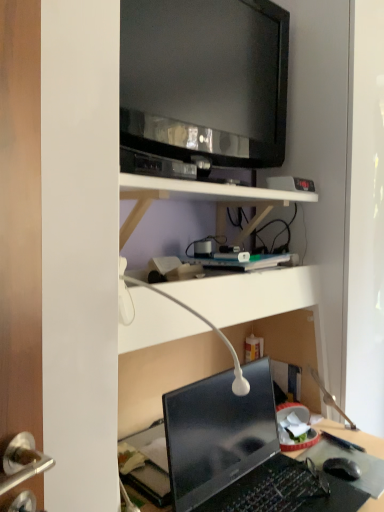
Find the location of a particular element. black glossy television at upper center is located at coordinates (205, 80).

Can you confirm if white matte shelf at upper center is positioned to the right of black glossy television at upper center?

No.

From a real-world perspective, which is physically below, white matte shelf at upper center or black glossy television at upper center?

From a 3D spatial view, white matte shelf at upper center is below.

Looking at this image, from their relative heights in the image, would you say white matte shelf at upper center is taller or shorter than black glossy television at upper center?

white matte shelf at upper center is shorter than black glossy television at upper center.

Considering the sizes of white matte shelf at upper center and black glossy television at upper center in the image, is white matte shelf at upper center wider or thinner than black glossy television at upper center?

Considering their sizes, white matte shelf at upper center looks broader than black glossy television at upper center.

Considering the relative sizes of black glossy television at upper center and white glossy table lamp at center in the image provided, is black glossy television at upper center shorter than white glossy table lamp at center?

In fact, black glossy television at upper center may be taller than white glossy table lamp at center.

Can you tell me how much black glossy television at upper center and white glossy table lamp at center differ in facing direction?

They differ by 0.701 degrees in their facing directions.

From a real-world perspective, which object rests below the other?

In real-world perspective, white glossy table lamp at center is lower.

Is black glossy television at upper center wider than white glossy table lamp at center?

In fact, black glossy television at upper center might be narrower than white glossy table lamp at center.

Based on the photo, is black matte computer mouse at lower right aimed at black glossy television at upper center?

No, black matte computer mouse at lower right is not aimed at black glossy television at upper center.

Is black matte computer mouse at lower right further to the viewer compared to black glossy television at upper center?

Yes, it is behind black glossy television at upper center.

Would you say black matte computer mouse at lower right is a long distance from black glossy television at upper center?

Yes, black matte computer mouse at lower right is far from black glossy television at upper center.

Which of these two, white glossy table lamp at center or black glossy television at upper center, is bigger?

black glossy television at upper center.

Does white glossy table lamp at center come behind black glossy television at upper center?

No, it is not.

Would you say white glossy table lamp at center is outside black glossy television at upper center?

Yes, white glossy table lamp at center is outside of black glossy television at upper center.

From a real-world perspective, is white glossy table lamp at center located higher than black glossy television at upper center?

Actually, white glossy table lamp at center is physically below black glossy television at upper center in the real world.

Is point (255, 501) farther from camera compared to point (331, 471)?

No.

I want to click on computer mouse on the right side of glossy black laptop at lower center, so click(342, 468).

Which is farther, (177, 86) or (181, 423)?

The point (177, 86) is behind.

This screenshot has width=384, height=512. Identify the location of laptop below the black glossy television at upper center (from the image's perspective). [x=231, y=448].

Is black glossy television at upper center completely or partially outside of glossy black laptop at lower center?

Absolutely, black glossy television at upper center is external to glossy black laptop at lower center.

Could you tell me if black glossy television at upper center is turned towards glossy black laptop at lower center?

No.

In the scene shown: Which object is wider, glossy black laptop at lower center or white glossy table lamp at center?

white glossy table lamp at center is wider.

Who is smaller, glossy black laptop at lower center or white glossy table lamp at center?

With smaller size is white glossy table lamp at center.

From the picture: Would you consider glossy black laptop at lower center to be distant from white glossy table lamp at center?

No, there isn't a large distance between glossy black laptop at lower center and white glossy table lamp at center.

How different are the orientations of glossy black laptop at lower center and white glossy table lamp at center in degrees?

The angle between the facing direction of glossy black laptop at lower center and the facing direction of white glossy table lamp at center is 0.000788 degrees.

The width and height of the screenshot is (384, 512). Identify the location of shelf below the black glossy television at upper center (from a real-world perspective). (202, 199).

Image resolution: width=384 pixels, height=512 pixels. I want to click on television located above the white glossy table lamp at center (from the image's perspective), so click(x=205, y=80).

From the image, which object appears to be nearer to white glossy table lamp at center, black matte computer mouse at lower right or glossy black laptop at lower center?

glossy black laptop at lower center is closer to white glossy table lamp at center.

Looking at this image, considering their positions, is glossy black laptop at lower center positioned further to white matte shelf at upper center than black matte computer mouse at lower right?

Based on the image, black matte computer mouse at lower right appears to be further to white matte shelf at upper center.

Based on their spatial positions, is black matte computer mouse at lower right or white glossy table lamp at center further from black glossy television at upper center?

black matte computer mouse at lower right lies further to black glossy television at upper center than the other object.

Based on their spatial positions, is black matte computer mouse at lower right or black glossy television at upper center further from white matte shelf at upper center?

black matte computer mouse at lower right.

Based on their spatial positions, is black glossy television at upper center or glossy black laptop at lower center further from white matte shelf at upper center?

Based on the image, glossy black laptop at lower center appears to be further to white matte shelf at upper center.

Estimate the real-world distances between objects in this image. Which object is further from black glossy television at upper center, white glossy table lamp at center or glossy black laptop at lower center?

glossy black laptop at lower center is positioned further to the anchor black glossy television at upper center.

Looking at the image, which one is located further to white glossy table lamp at center, glossy black laptop at lower center or black matte computer mouse at lower right?

black matte computer mouse at lower right.

Consider the image. Estimate the real-world distances between objects in this image. Which object is closer to black glossy television at upper center, black matte computer mouse at lower right or glossy black laptop at lower center?

glossy black laptop at lower center.

The image size is (384, 512). Find the location of `table lamp that lies between white matte shelf at upper center and glossy black laptop at lower center from top to bottom`. table lamp that lies between white matte shelf at upper center and glossy black laptop at lower center from top to bottom is located at coordinates (210, 327).

This screenshot has width=384, height=512. What are the coordinates of `table lamp that lies between black glossy television at upper center and glossy black laptop at lower center from top to bottom` in the screenshot? It's located at (210, 327).

At what (x,y) coordinates should I click in order to perform the action: click on shelf that lies between black glossy television at upper center and white glossy table lamp at center from top to bottom. Please return your answer as a coordinate pair (x, y). Looking at the image, I should click on (202, 199).

I want to click on table lamp between black glossy television at upper center and black matte computer mouse at lower right from top to bottom, so click(x=210, y=327).